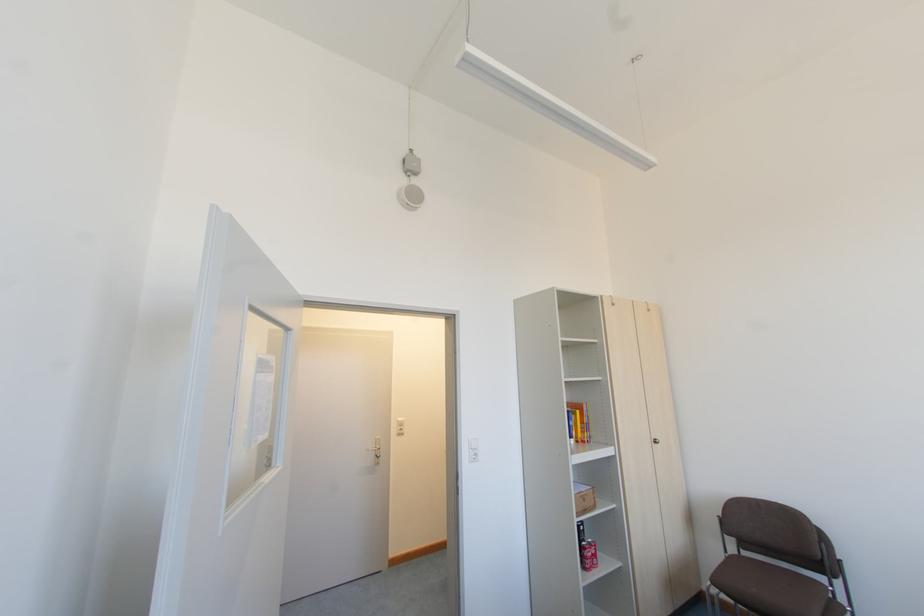
I want to click on red soda can, so click(589, 554).